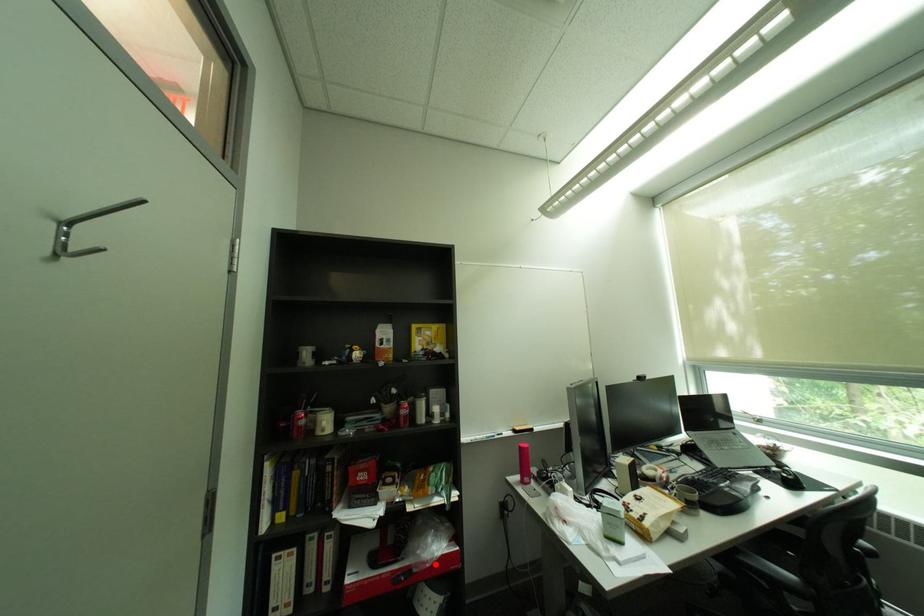
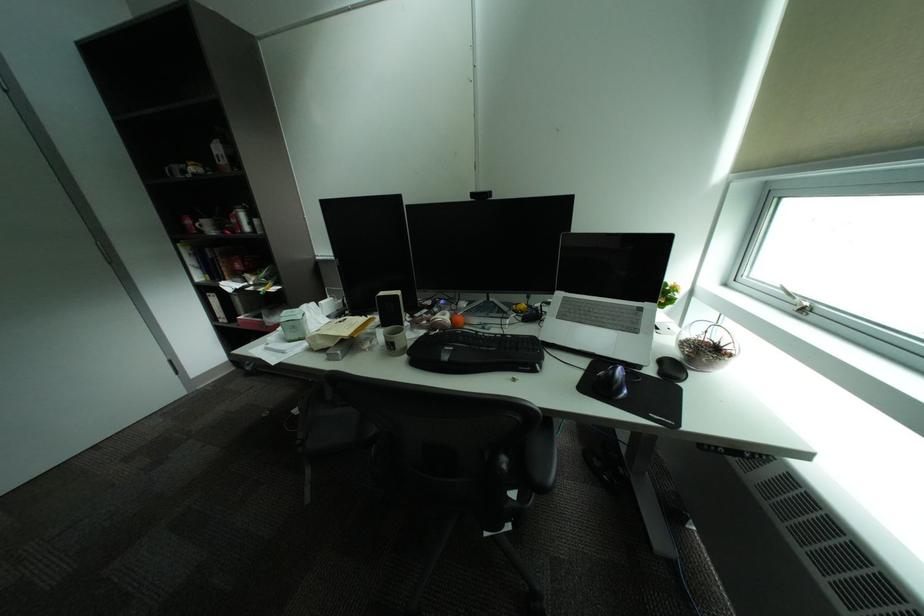
Question: I am providing you with two images of the same scene from different viewpoints. Given a red point in image1, look at the same physical point in image2. Is it:

Choices:
 (A) Closer to the viewpoint
 (B) Farther from the viewpoint

Answer: (B)